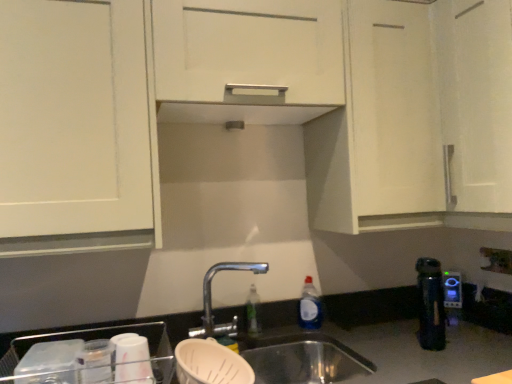
Question: Is point (351, 104) positioned closer to the camera than point (492, 256)?

Choices:
 (A) farther
 (B) closer

Answer: (B)

Question: Is white matte cabinet at upper center inside the boundaries of white plastic electric outlet at lower right, or outside?

Choices:
 (A) outside
 (B) inside

Answer: (A)

Question: Estimate the real-world distances between objects in this image. Which object is closer to the white matte cabinet at upper center?

Choices:
 (A) blue plastic kettle at right
 (B) stainless steel sink at lower center
 (C) white plastic electric outlet at lower right
 (D) blue plastic bottle at sink

Answer: (B)

Question: Which is farther from the blue plastic kettle at right?

Choices:
 (A) blue plastic bottle at sink
 (B) stainless steel sink at lower center
 (C) white matte cabinet at upper center
 (D) white plastic electric outlet at lower right

Answer: (C)